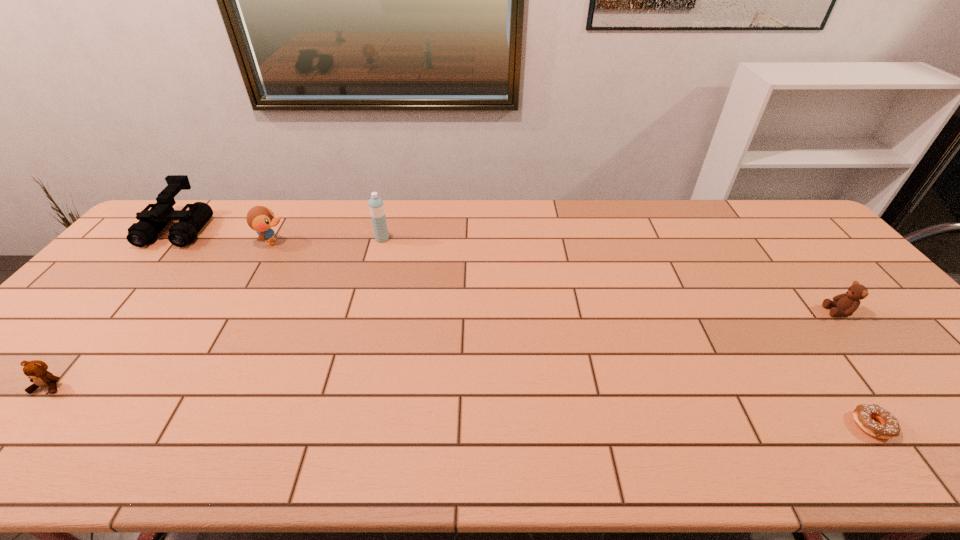
Point out which object is positioned as the second nearest to the farther teddy bear. Please provide its 2D coordinates. Your answer should be formatted as a tuple, i.e. [(x, y)], where the tuple contains the x and y coordinates of a point satisfying the conditions above.

[(376, 206)]

This screenshot has width=960, height=540. What are the coordinates of `vacant space that satisfies the following two spatial constraints: 1. on the face of the third nearest object; 2. on the front-facing side of the shorter teddy bear` in the screenshot? It's located at 900,386.

In order to click on free space that satisfies the following two spatial constraints: 1. on the front-facing side of the doughnut; 2. on the right side of the duck in this screenshot , I will do `click(168, 426)`.

Where is `vacant region that satisfies the following two spatial constraints: 1. on the front side of the tallest object; 2. on the front-facing side of the duck`? vacant region that satisfies the following two spatial constraints: 1. on the front side of the tallest object; 2. on the front-facing side of the duck is located at coordinates (381, 242).

Find the location of a particular element. The height and width of the screenshot is (540, 960). free location that satisfies the following two spatial constraints: 1. on the face of the rightmost object; 2. on the front-facing side of the fifth farthest object is located at coordinates (900, 386).